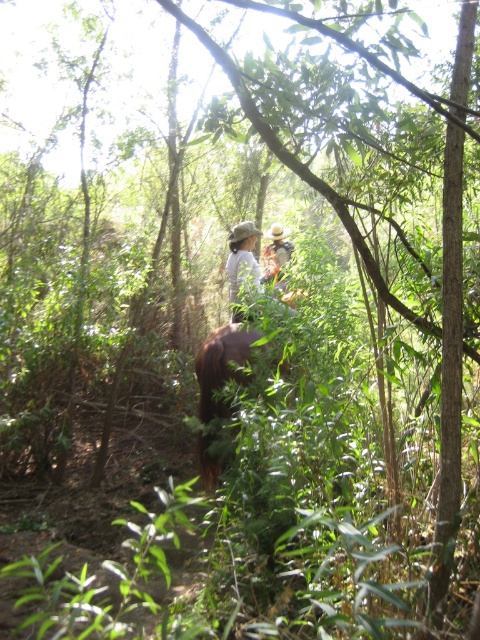
You are a photographer trying to capture a clear photo of the wooden hat at center while the brown furry horse at center is moving. Which object should you focus on first to ensure the photo is in focus?

You should focus on the brown furry horse at center first because it is bigger than the wooden hat at center, making it easier to focus on the larger object before adjusting for the smaller one.